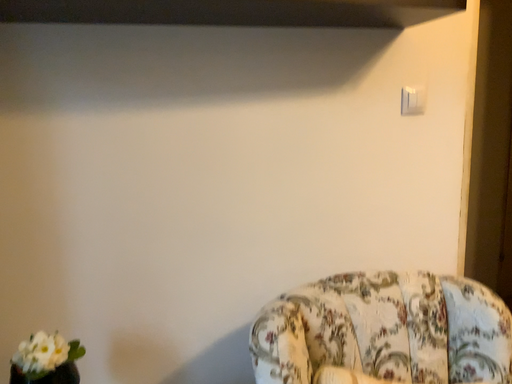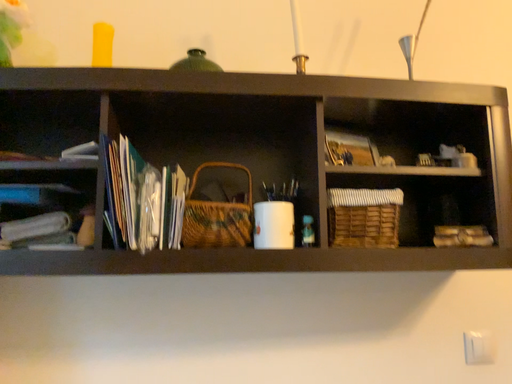
Question: How did the camera likely rotate when shooting the video?

Choices:
 (A) rotated upward
 (B) rotated downward

Answer: (A)